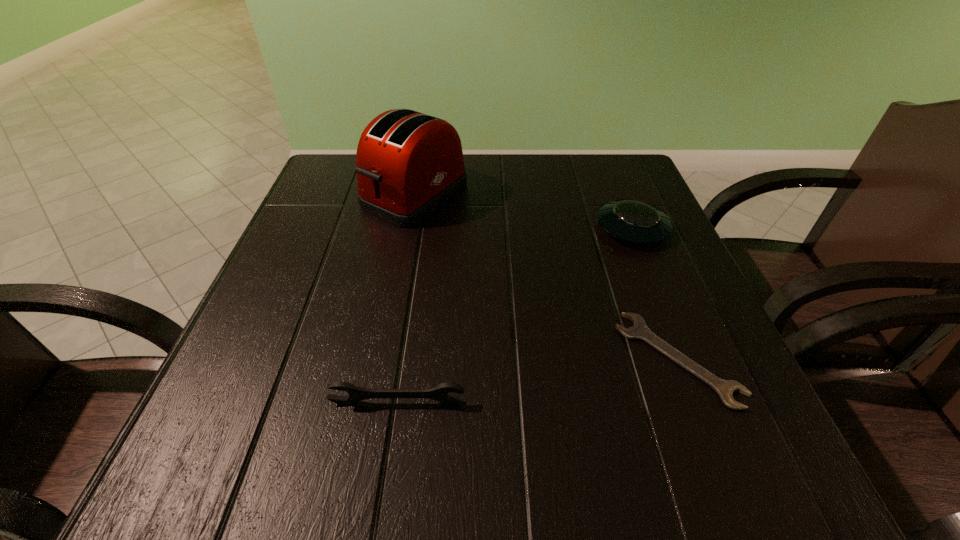
Find the location of `the third closest object to the right wrench`. the third closest object to the right wrench is located at coordinates coord(408,164).